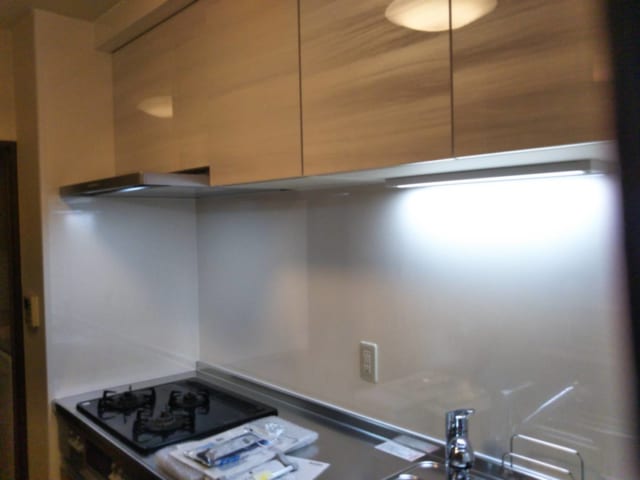
Where is `cabinets`? The width and height of the screenshot is (640, 480). cabinets is located at coordinates coord(236,157).